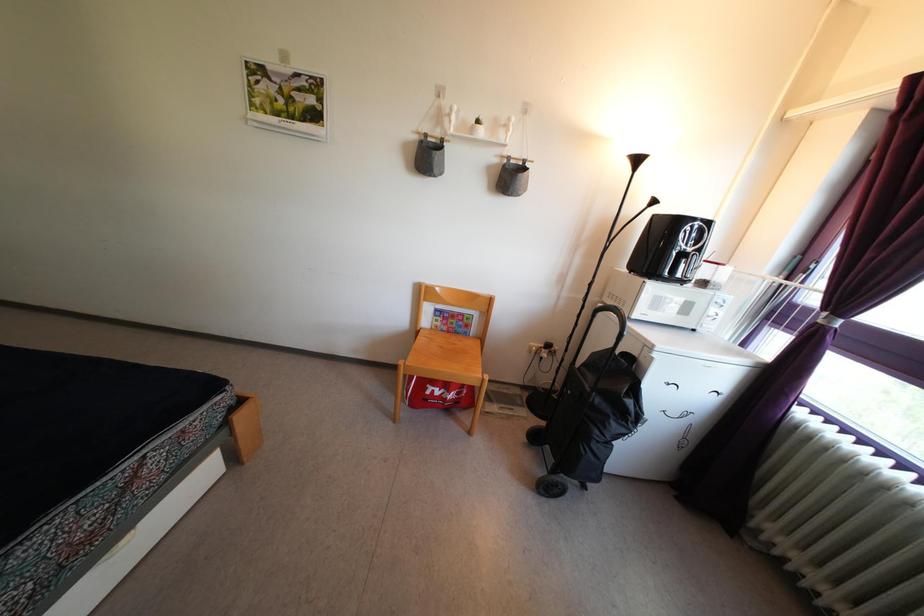
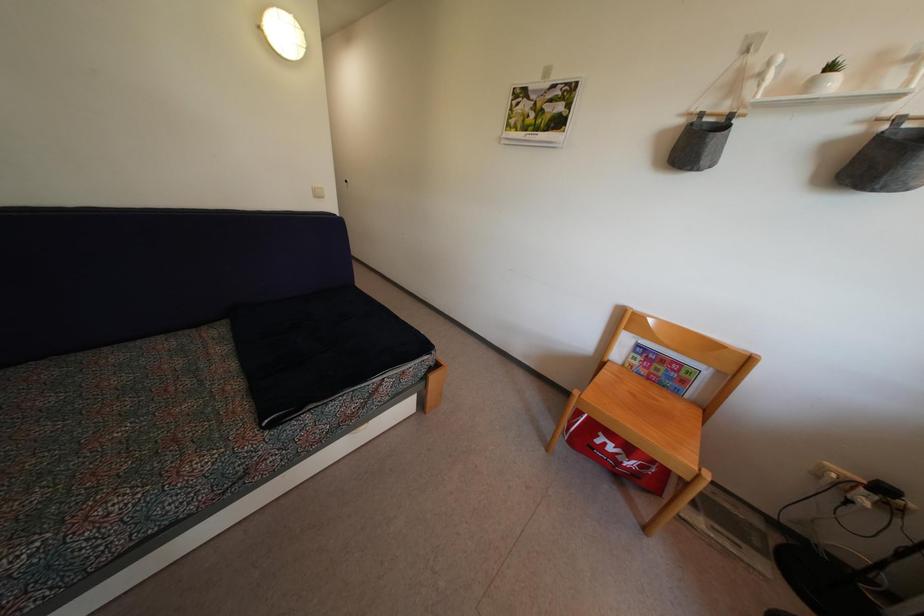
Where in the second image is the point corresponding to [431,400] from the first image?

(601, 450)